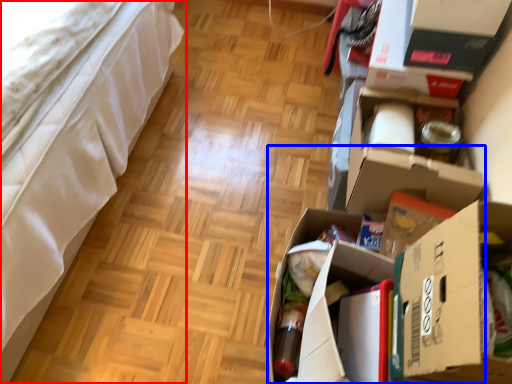
Question: Among these objects, which one is farthest to the camera, furniture (highlighted by a red box) or cardboard box (highlighted by a blue box)?

Choices:
 (A) furniture
 (B) cardboard box

Answer: (B)